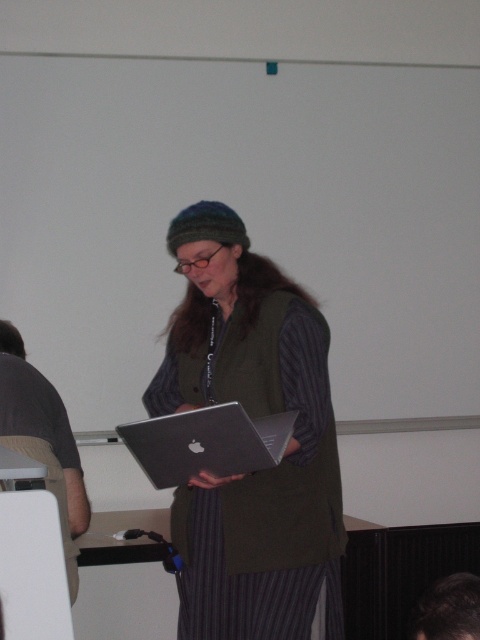
Question: From the image, what is the correct spatial relationship of silver metallic laptop at center in relation to dark hair at lower right?

Choices:
 (A) above
 (B) below

Answer: (A)

Question: Is silver metallic laptop at center behind dark hair at lower right?

Choices:
 (A) yes
 (B) no

Answer: (A)

Question: Based on their relative distances, which object is farther from the matte silver laptop at center?

Choices:
 (A) dark hair at lower right
 (B) silver metallic laptop at center
 (C) gray fabric shirt at left

Answer: (A)

Question: Estimate the real-world distances between objects in this image. Which object is closer to the gray fabric shirt at left?

Choices:
 (A) silver metallic laptop at center
 (B) matte silver laptop at center
 (C) dark hair at lower right

Answer: (A)

Question: Can you confirm if matte silver laptop at center is bigger than dark hair at lower right?

Choices:
 (A) yes
 (B) no

Answer: (A)

Question: Which object appears closest to the camera in this image?

Choices:
 (A) matte silver laptop at center
 (B) silver metallic laptop at center
 (C) dark hair at lower right

Answer: (C)